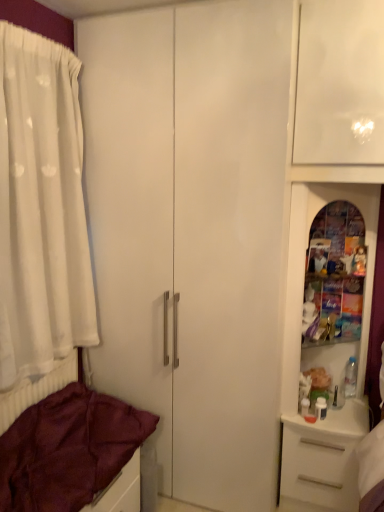
Question: Considering the relative sizes of white sheer curtain at left and white plastic drawer at lower right in the image provided, is white sheer curtain at left wider than white plastic drawer at lower right?

Choices:
 (A) yes
 (B) no

Answer: (B)

Question: Is white sheer curtain at left outside white plastic drawer at lower right?

Choices:
 (A) no
 (B) yes

Answer: (B)

Question: Considering the relative sizes of white sheer curtain at left and white plastic drawer at lower right in the image provided, is white sheer curtain at left shorter than white plastic drawer at lower right?

Choices:
 (A) no
 (B) yes

Answer: (A)

Question: Is white sheer curtain at left placed right next to white plastic drawer at lower right?

Choices:
 (A) yes
 (B) no

Answer: (B)

Question: Is white sheer curtain at left closer to the viewer compared to white plastic drawer at lower right?

Choices:
 (A) yes
 (B) no

Answer: (A)

Question: From a real-world perspective, is white sheer curtain at left physically above white plastic drawer at lower right?

Choices:
 (A) no
 (B) yes

Answer: (B)

Question: Is maroon fabric bed at lower left completely or partially outside of white plastic drawer at lower right?

Choices:
 (A) no
 (B) yes

Answer: (B)

Question: Is maroon fabric bed at lower left at the right side of white plastic drawer at lower right?

Choices:
 (A) yes
 (B) no

Answer: (B)

Question: From the image's perspective, would you say maroon fabric bed at lower left is positioned over white plastic drawer at lower right?

Choices:
 (A) yes
 (B) no

Answer: (A)

Question: Is maroon fabric bed at lower left looking in the opposite direction of white plastic drawer at lower right?

Choices:
 (A) no
 (B) yes

Answer: (A)

Question: Is maroon fabric bed at lower left touching white plastic drawer at lower right?

Choices:
 (A) no
 (B) yes

Answer: (A)

Question: Considering the relative positions of maroon fabric bed at lower left and white plastic drawer at lower right in the image provided, is maroon fabric bed at lower left to the left of white plastic drawer at lower right from the viewer's perspective?

Choices:
 (A) no
 (B) yes

Answer: (B)

Question: Is maroon fabric bed at lower left to the left of white sheer curtain at left from the viewer's perspective?

Choices:
 (A) no
 (B) yes

Answer: (A)